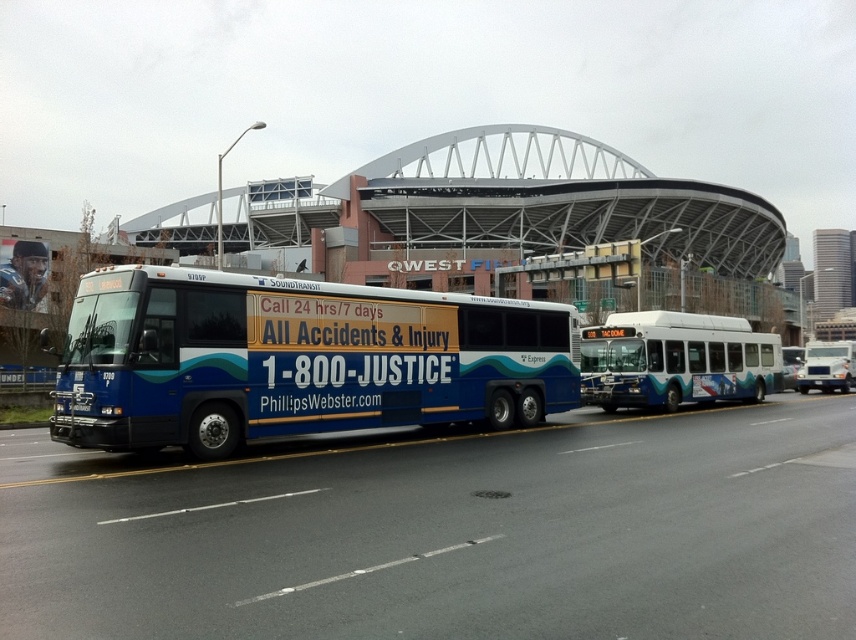
You are a pedestrian standing on the sidewalk and see the blue metallic bus at center and the white matte truck at center. Which one is closer to you?

The blue metallic bus at center is closer because it is positioned over the white matte truck at center, indicating it is in front.

You are a delivery person who needs to enter a low clearance tunnel that allows vehicles up to 14 feet in height. You have to choose between the blue metallic bus at center and the white matte truck at center. Which vehicle should you avoid to ensure safe passage?

The blue metallic bus at center has a greater height compared to the white matte truck at center. Therefore, you should avoid the blue metallic bus at center to ensure safe passage through the low clearance tunnel.

You are a pedestrian standing on the sidewalk and see both the white glossy bus at center and the white matte truck at center. Which one is higher up in the image?

The white glossy bus at center is higher up in the image than the white matte truck at center.